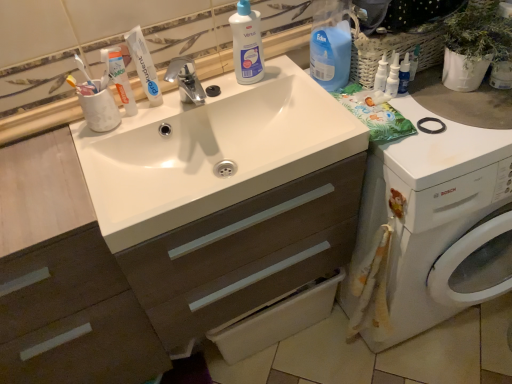
Find the location of a particular element. free space in front of white glossy toothpaste tube at upper left is located at coordinates (95, 157).